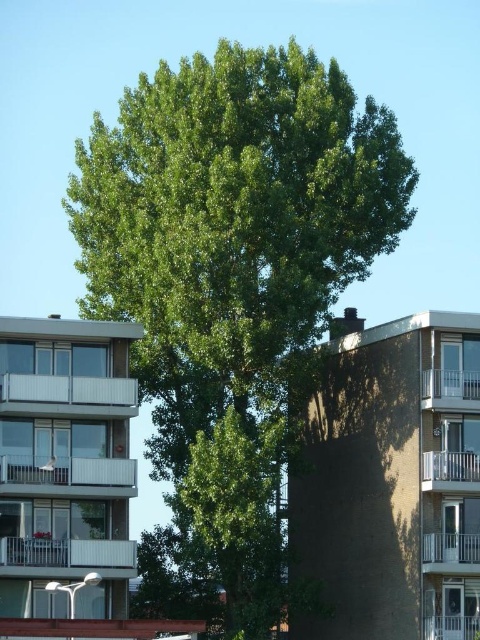
Consider the image. Which is below, green leafy tree at center or white plastic balcony at lower right?

Positioned lower is white plastic balcony at lower right.

Describe the element at coordinates (231, 289) in the screenshot. I see `green leafy tree at center` at that location.

Does point (250, 252) come behind point (436, 572)?

Yes, point (250, 252) is farther from viewer.

I want to click on green leafy tree at center, so click(x=231, y=289).

Does white glass balcony at left have a smaller size compared to white plastic balcony at center-right?

Yes, white glass balcony at left is smaller than white plastic balcony at center-right.

Looking at this image, is the position of white glass balcony at left more distant than that of white plastic balcony at center-right?

No, it is not.

Is point (70, 387) less distant than point (422, 472)?

Yes, it is in front of point (422, 472).

Find the location of `white glass balcony at left`. white glass balcony at left is located at coordinates (68, 396).

Is white plastic balcony at lower right below white metal balcony at upper right?

Indeed, white plastic balcony at lower right is positioned under white metal balcony at upper right.

Between white plastic balcony at lower right and white metal balcony at upper right, which one has more height?

white metal balcony at upper right is taller.

Locate an element on the screen. The width and height of the screenshot is (480, 640). white plastic balcony at lower right is located at coordinates (451, 554).